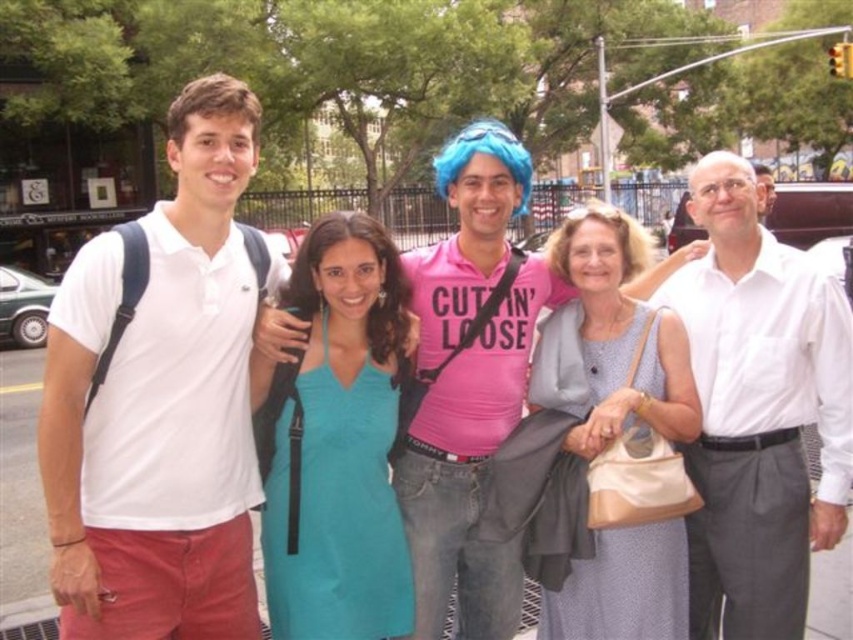
Question: Which object appears closest to the camera in this image?

Choices:
 (A) white cotton polo shirt at left
 (B) white cotton shirt at right

Answer: (A)

Question: Does white cotton polo shirt at left have a lesser width compared to white cotton shirt at right?

Choices:
 (A) yes
 (B) no

Answer: (B)

Question: From the image, what is the correct spatial relationship of white cotton polo shirt at left in relation to light blue fabric dress at center?

Choices:
 (A) right
 (B) left

Answer: (B)

Question: Which point is farther to the camera?

Choices:
 (A) light blue fabric dress at center
 (B) white cotton polo shirt at left
 (C) white cotton shirt at right

Answer: (C)

Question: Which point appears closest to the camera in this image?

Choices:
 (A) (177, 636)
 (B) (756, 276)

Answer: (A)

Question: Is white cotton polo shirt at left closer to the viewer compared to white cotton shirt at right?

Choices:
 (A) yes
 (B) no

Answer: (A)